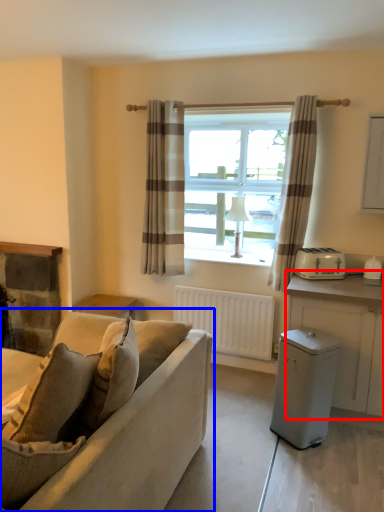
Question: Which object is further to the camera taking this photo, cabinetry (highlighted by a red box) or studio couch (highlighted by a blue box)?

Choices:
 (A) cabinetry
 (B) studio couch

Answer: (A)